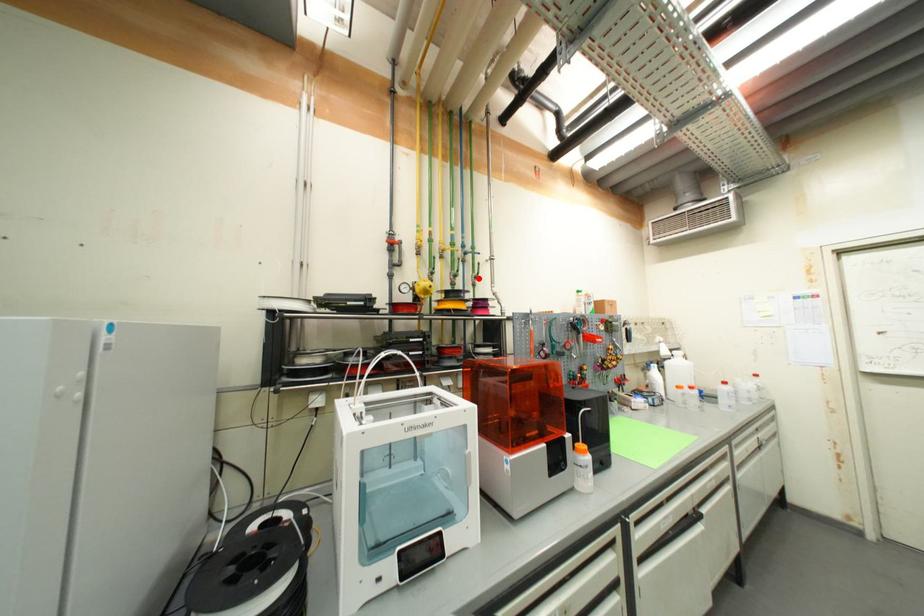
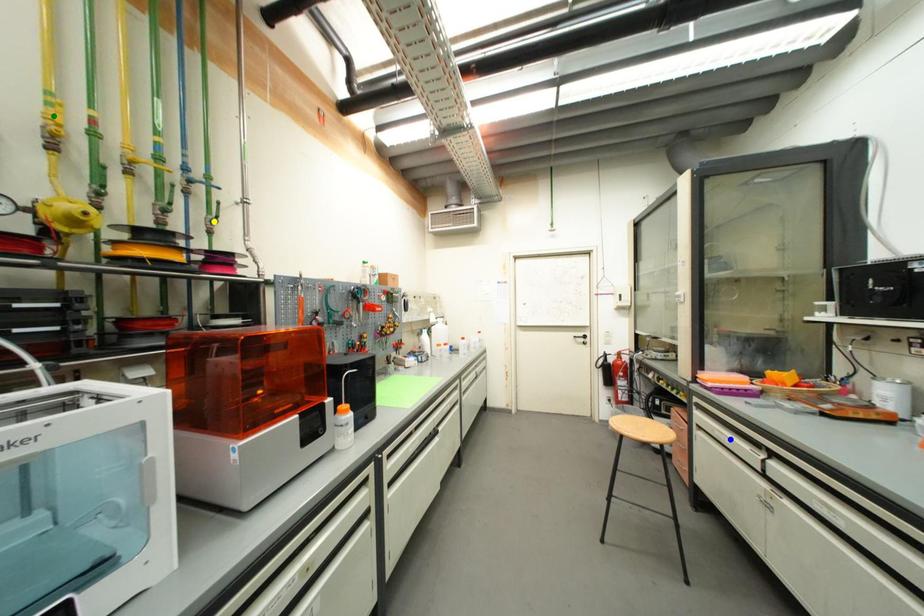
Question: I am providing you with two images of the same scene from different viewpoints. A red point is marked on the first image. You are given multiple points on the second image. Which mark in image 2 goes with the point in image 1?

Choices:
 (A) yellow point
 (B) blue point
 (C) green point

Answer: (A)